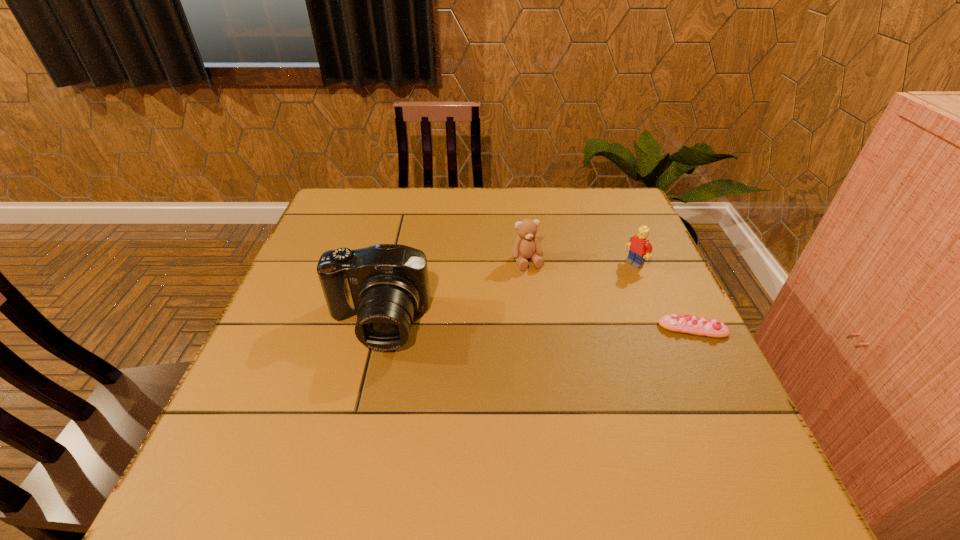
Locate an element on the screen. The height and width of the screenshot is (540, 960). the tallest object is located at coordinates (385, 285).

The height and width of the screenshot is (540, 960). Find the location of `the leftmost object`. the leftmost object is located at coordinates (385, 285).

Locate an element on the screen. Image resolution: width=960 pixels, height=540 pixels. the shortest object is located at coordinates (691, 325).

What are the coordinates of `the second object from left to right` in the screenshot? It's located at (526, 245).

This screenshot has width=960, height=540. What are the coordinates of `Lego` in the screenshot? It's located at (640, 248).

Find the location of a particular element. The height and width of the screenshot is (540, 960). vacant region located on the lens of the tallest object is located at coordinates (359, 400).

Find the location of a particular element. free location located on the left of the eclair is located at coordinates (495, 329).

Find the location of a particular element. The image size is (960, 540). free location located 0.340m on the face of the teddy bear is located at coordinates (581, 378).

Find the location of `blank area located on the face of the teddy bear`. blank area located on the face of the teddy bear is located at coordinates (585, 386).

The height and width of the screenshot is (540, 960). I want to click on vacant space located on the face of the teddy bear, so click(549, 309).